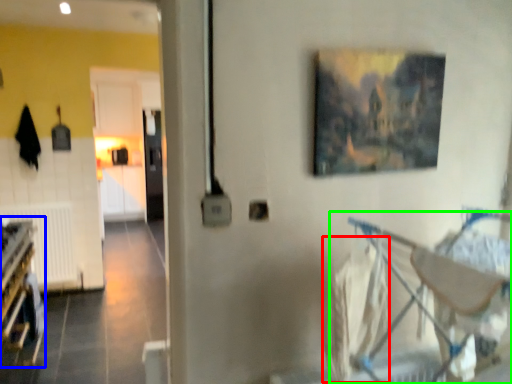
Question: Which object is the farthest from laundry (highlighted by a red box)? Choose among these: bunk bed (highlighted by a blue box) or baby carriage (highlighted by a green box).

Choices:
 (A) bunk bed
 (B) baby carriage

Answer: (A)